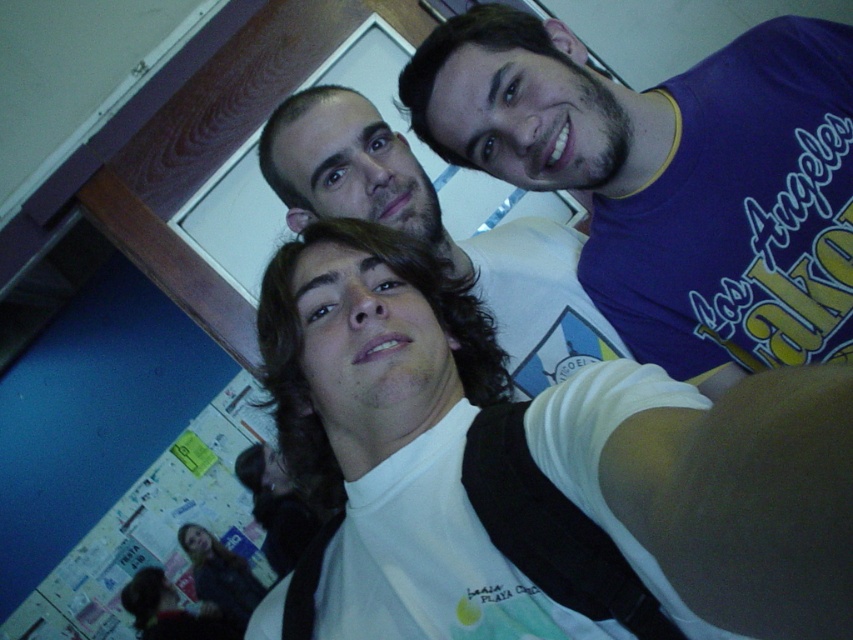
Imagine you are standing in the room where the selfie was taken. You see two points marked in the image. The first point is at coordinate point [614,248] and the second point is at coordinate point [315,182]. Which point is closer to you?

Point [614,248] is closer to the camera than point [315,182].

You are trying to decide which object is wider between the white matte shirt at center and the smooth black hair at lower left. Based on the scene, which one is wider?

The white matte shirt at center is wider than the smooth black hair at lower left.